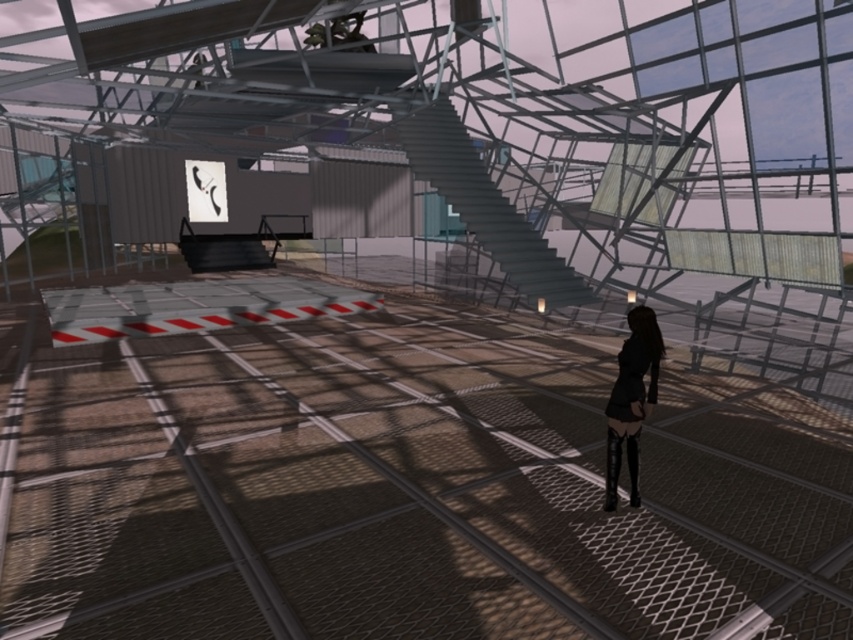
Question: Does metallic gray staircase at center have a larger size compared to black leather dress at lower right?

Choices:
 (A) no
 (B) yes

Answer: (B)

Question: Can you confirm if metallic gray staircase at center is positioned below black leather dress at lower right?

Choices:
 (A) yes
 (B) no

Answer: (B)

Question: Is metallic gray staircase at center thinner than black leather dress at lower right?

Choices:
 (A) yes
 (B) no

Answer: (B)